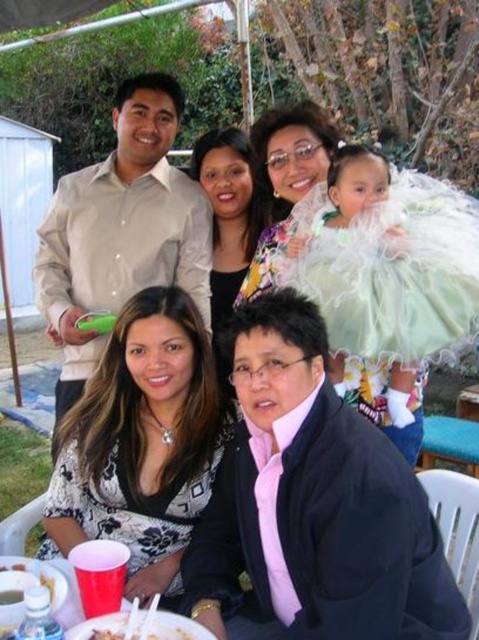
Which is more to the right, beige smooth shirt at upper left or matte white dress at upper center?

matte white dress at upper center

Which is behind, point (91, 232) or point (284, 161)?

The point (91, 232) is behind.

Locate an element on the screen. beige smooth shirt at upper left is located at coordinates (122, 228).

Can you confirm if floral-patterned blouse at lower left is smaller than floral fabric blouse at center?

Incorrect, floral-patterned blouse at lower left is not smaller in size than floral fabric blouse at center.

Does point (156, 356) come farther from viewer compared to point (237, 180)?

No, (156, 356) is in front of (237, 180).

What do you see at coordinates (141, 442) in the screenshot? Image resolution: width=479 pixels, height=640 pixels. I see `floral-patterned blouse at lower left` at bounding box center [141, 442].

The height and width of the screenshot is (640, 479). Identify the location of floral-patterned blouse at lower left. (141, 442).

Is floral-patterned blouse at lower left positioned before matte white dress at upper center?

Yes, it is in front of matte white dress at upper center.

Does floral-patterned blouse at lower left have a larger size compared to matte white dress at upper center?

Yes, floral-patterned blouse at lower left is bigger than matte white dress at upper center.

Does point (117, 376) come farther from viewer compared to point (242, 294)?

No, it is in front of (242, 294).

Locate an element on the screen. Image resolution: width=479 pixels, height=640 pixels. floral-patterned blouse at lower left is located at coordinates (141, 442).